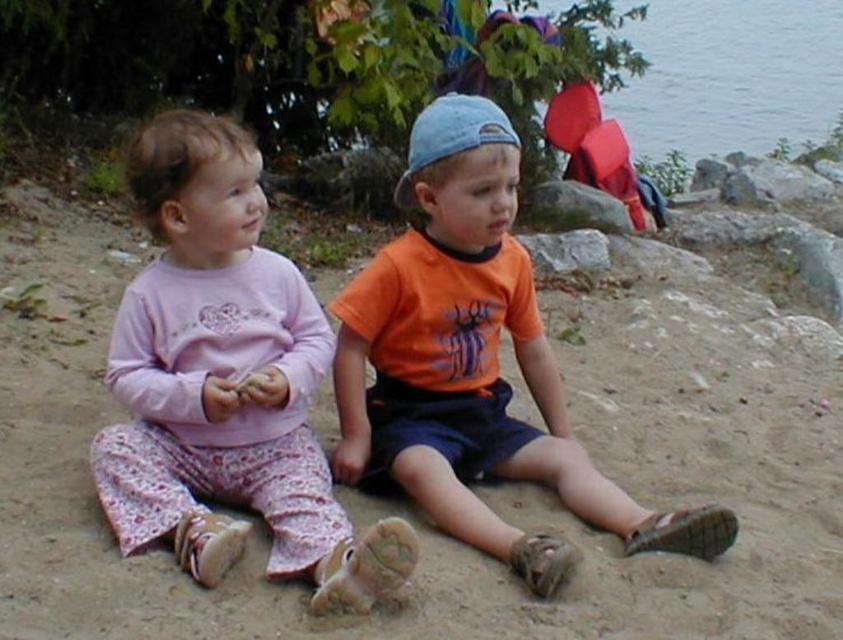
Question: Can you confirm if pink cotton pajamas at left is positioned to the right of transparent water at upper right?

Choices:
 (A) no
 (B) yes

Answer: (A)

Question: Estimate the real-world distances between objects in this image. Which object is closer to the orange cotton shirt at center?

Choices:
 (A) transparent water at upper right
 (B) pink cotton pajamas at left
 (C) brown sandy ground at center

Answer: (B)

Question: Is brown sandy ground at center to the right of transparent water at upper right from the viewer's perspective?

Choices:
 (A) yes
 (B) no

Answer: (B)

Question: Which of the following is the closest to the observer?

Choices:
 (A) (701, 20)
 (B) (356, 230)
 (C) (154, 438)

Answer: (C)

Question: Which point appears farthest from the camera in this image?

Choices:
 (A) (239, 456)
 (B) (464, 204)

Answer: (B)

Question: Does pink cotton pajamas at left have a smaller size compared to orange cotton shirt at center?

Choices:
 (A) yes
 (B) no

Answer: (A)